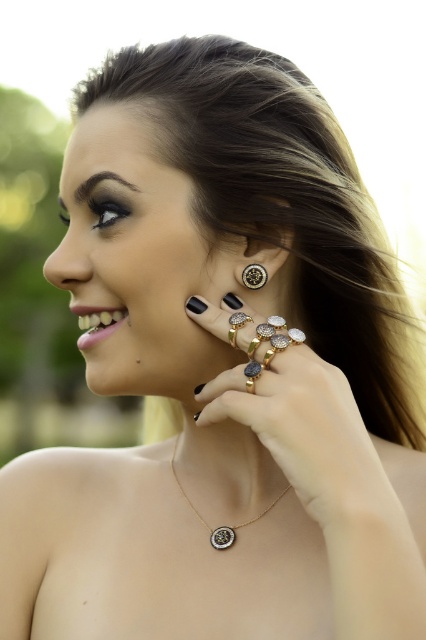
You are a photographer adjusting your camera settings to capture a subject at a specific distance. The camera is currently focused on the point at coordinates point (x=270, y=202). If the recommended focusing distance for optimal sharpness is 30 inches, is the current focus distance sufficient?

The point (x=270, y=202) is 28.80 inches away from the camera, which is slightly less than the recommended 30 inches. Therefore, the current focus distance may not be sufficient for optimal sharpness.